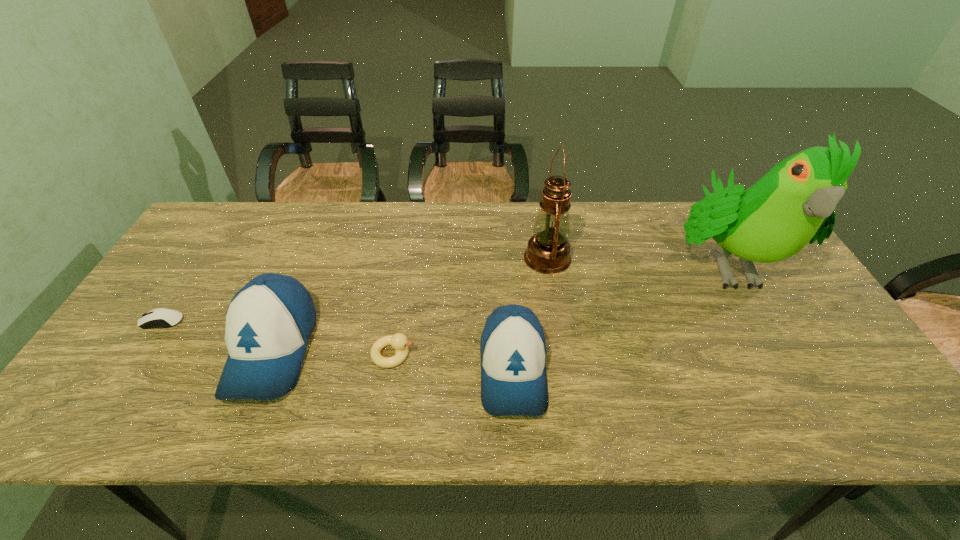
This screenshot has height=540, width=960. What are the coordinates of `free space between the second tallest object and the fifth object from right to left` in the screenshot? It's located at click(410, 303).

Image resolution: width=960 pixels, height=540 pixels. Identify the location of vacant region between the fourth tallest object and the fifth tallest object. (453, 362).

Select which object appears as the closest to the fifth tallest object. Please provide its 2D coordinates. Your answer should be formatted as a tuple, i.e. [(x, y)], where the tuple contains the x and y coordinates of a point satisfying the conditions above.

[(269, 321)]

You are a GUI agent. You are given a task and a screenshot of the screen. Output one action in this format:
    pyautogui.click(x=<x>, y=<y>)
    Task: Click on the object that stands as the closest to the oil lamp
    The image size is (960, 540).
    Given the screenshot: What is the action you would take?
    pyautogui.click(x=513, y=351)

The height and width of the screenshot is (540, 960). I want to click on free location that satisfies the following two spatial constraints: 1. on the back side of the mouse; 2. on the right side of the oil lamp, so click(x=204, y=258).